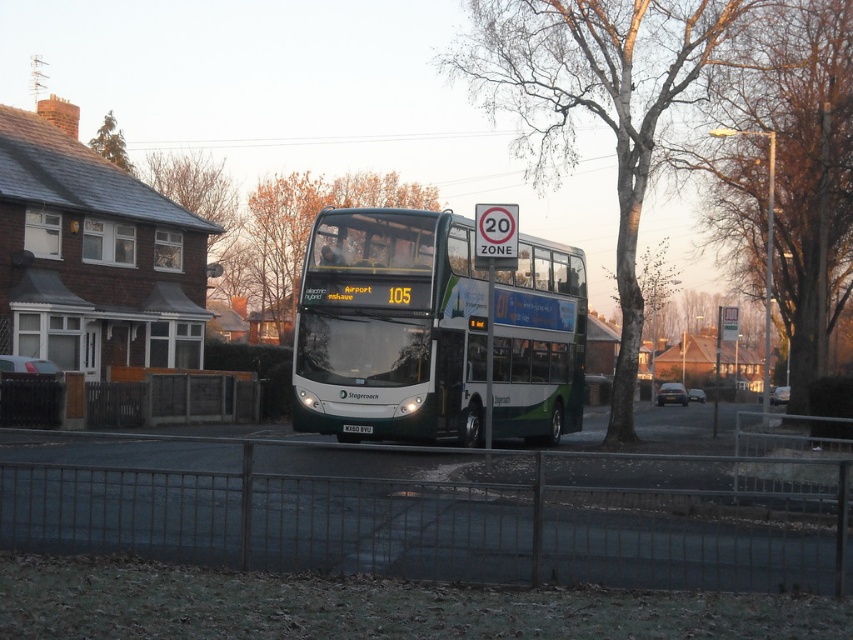
Who is lower down, bare wood tree at center or black plastic license plate at center?

black plastic license plate at center is below.

Is bare wood tree at center below black plastic license plate at center?

No.

Is point (663, 102) positioned behind point (352, 424)?

Yes, it is behind point (352, 424).

Where is `bare wood tree at center`? bare wood tree at center is located at coordinates (595, 104).

Which of these two, green leafy tree at upper left or black plastic license plate at center, stands shorter?

With less height is black plastic license plate at center.

Is green leafy tree at upper left above black plastic license plate at center?

Indeed, green leafy tree at upper left is positioned over black plastic license plate at center.

Who is more distant from viewer, (107, 138) or (354, 433)?

Positioned behind is point (107, 138).

Where is `green leafy tree at upper left`? green leafy tree at upper left is located at coordinates (109, 141).

Does bare wood tree at center lie in front of green leafy tree at upper left?

Yes.

Between point (554, 38) and point (119, 156), which one is positioned behind?

The point (119, 156) is behind.

Is point (625, 291) positioned after point (96, 148)?

No, (625, 291) is closer to viewer.

Where is `bare wood tree at center`? The image size is (853, 640). bare wood tree at center is located at coordinates (595, 104).